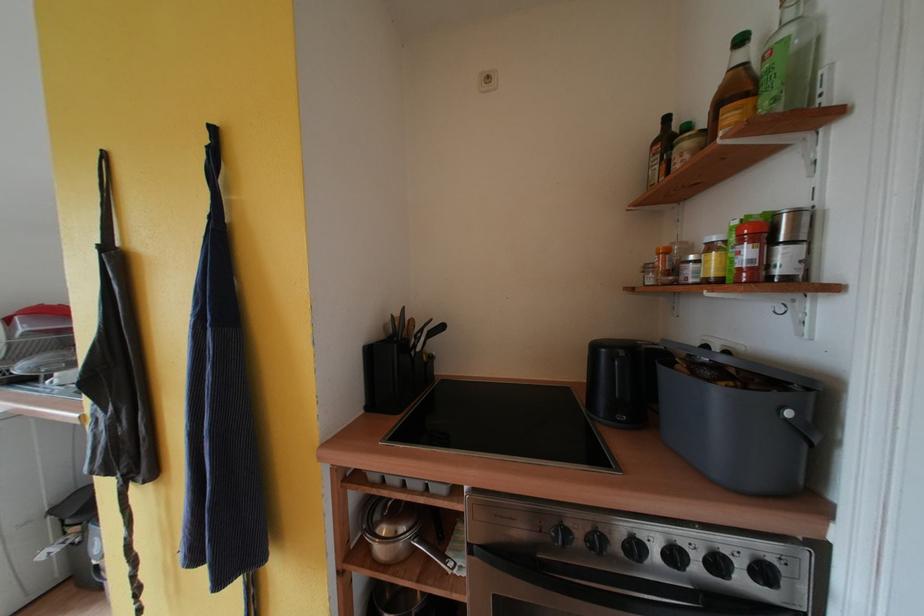
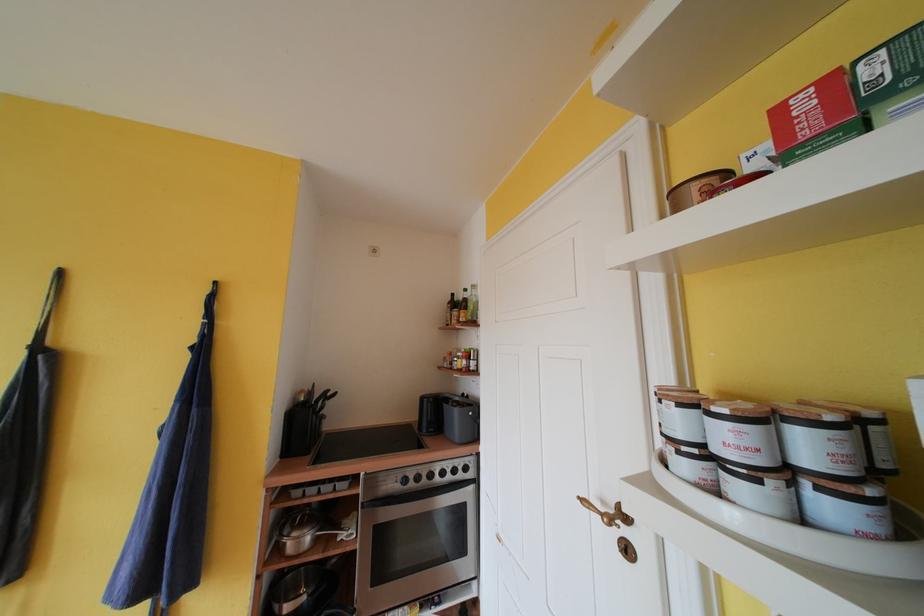
Find the pixel in the second image that matches (701,561) in the first image.

(455, 474)